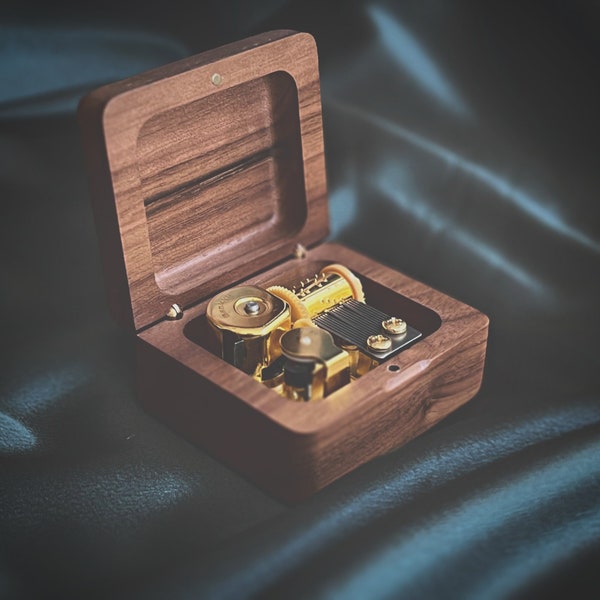
Find the location of a particular element. This screenshot has height=600, width=600. right hinge is located at coordinates (297, 249).